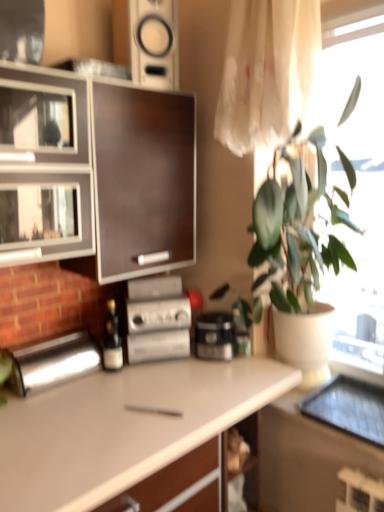
Find the location of `white glossy speaker at upper center`. white glossy speaker at upper center is located at coordinates (154, 42).

What do you see at coordinates (295, 232) in the screenshot?
I see `green matte plant at upper right` at bounding box center [295, 232].

The height and width of the screenshot is (512, 384). What do you see at coordinates (243, 463) in the screenshot?
I see `wooden shelf at lower center` at bounding box center [243, 463].

What do you see at coordinates (130, 168) in the screenshot? I see `dark wood cabinet at left` at bounding box center [130, 168].

This screenshot has height=512, width=384. What do you see at coordinates (267, 72) in the screenshot? I see `translucent white curtain at upper right` at bounding box center [267, 72].

Locate an element on the screen. The image size is (384, 512). silver metallic stereo at center, acting as the 2th appliance starting from the left is located at coordinates (157, 319).

Is green matte plant at upper right not within dark wood cabinet at left?

Indeed, green matte plant at upper right is completely outside dark wood cabinet at left.

Which is farther from the camera, (318,283) or (80,213)?

Positioned behind is point (318,283).

What's the angular difference between green matte plant at upper right and dark wood cabinet at left's facing directions?

green matte plant at upper right and dark wood cabinet at left are facing 90.1 degrees away from each other.

From a real-world perspective, is green matte plant at upper right physically below dark wood cabinet at left?

Yes, from a real-world perspective, green matte plant at upper right is under dark wood cabinet at left.

Can you confirm if polished stainless steel bread bin at left, the 2th appliance positioned from the right, is taller than silver metallic stereo at center, acting as the 2th appliance starting from the left?

Incorrect, the height of polished stainless steel bread bin at left, the 2th appliance positioned from the right, is not larger of that of silver metallic stereo at center, acting as the 2th appliance starting from the left.

You are a GUI agent. You are given a task and a screenshot of the screen. Output one action in this format:
    pyautogui.click(x=<x>, y=<y>)
    Task: Click on the appliance above the polished stainless steel bread bin at left, acting as the first appliance starting from the left (from a real-world perspective)
    The image size is (384, 512).
    Given the screenshot: What is the action you would take?
    pyautogui.click(x=157, y=319)

Is polished stainless steel bread bin at left, acting as the first appliance starting from the left, beside silver metallic stereo at center, acting as the 2th appliance starting from the left?

No, polished stainless steel bread bin at left, acting as the first appliance starting from the left, is not beside silver metallic stereo at center, acting as the 2th appliance starting from the left.

How much distance is there between polished stainless steel bread bin at left, acting as the first appliance starting from the left, and silver metallic stereo at center, acting as the 2th appliance starting from the left?

11.27 inches.

From a real-world perspective, which is physically above, green matte plant at upper right or translucent white curtain at upper right?

translucent white curtain at upper right, from a real-world perspective.

Which is correct: green matte plant at upper right is inside translucent white curtain at upper right, or outside of it?

green matte plant at upper right cannot be found inside translucent white curtain at upper right.

From the image's perspective, which is above, green matte plant at upper right or translucent white curtain at upper right?

translucent white curtain at upper right, from the image's perspective.

Are translucent white curtain at upper right and white glossy speaker at upper center far apart?

No.

What's the angular difference between translucent white curtain at upper right and white glossy speaker at upper center's facing directions?

75.2 degrees.

Is translucent white curtain at upper right bigger than white glossy speaker at upper center?

Indeed, translucent white curtain at upper right has a larger size compared to white glossy speaker at upper center.

Is translucent white curtain at upper right to the left of white glossy speaker at upper center from the viewer's perspective?

Incorrect, translucent white curtain at upper right is not on the left side of white glossy speaker at upper center.

Is dark wood cabinet at left positioned before black plastic coffee maker at center?

Yes, it is in front of black plastic coffee maker at center.

Does dark wood cabinet at left contain black plastic coffee maker at center?

No, dark wood cabinet at left does not contain black plastic coffee maker at center.

Is dark wood cabinet at left directly adjacent to black plastic coffee maker at center?

No, dark wood cabinet at left is not touching black plastic coffee maker at center.

This screenshot has height=512, width=384. Find the location of `cabinetry above the black plastic coffee maker at center (from a real-world perspective)`. cabinetry above the black plastic coffee maker at center (from a real-world perspective) is located at coordinates (130, 168).

Can we say dark wood cabinet at left lies outside wooden shelf at lower center?

Answer: Yes, dark wood cabinet at left is outside of wooden shelf at lower center.

You are a GUI agent. You are given a task and a screenshot of the screen. Output one action in this format:
    pyautogui.click(x=<x>, y=<y>)
    Task: Click on the cabinetry in front of the wooden shelf at lower center
    
    Given the screenshot: What is the action you would take?
    pyautogui.click(x=130, y=168)

From a real-world perspective, does dark wood cabinet at left sit lower than wooden shelf at lower center?

No.

Is polished stainless steel bread bin at left, the 2th appliance positioned from the right, at the back of silver metallic stereo at center, acting as the 2th appliance starting from the left?

Result: That's not correct — silver metallic stereo at center, acting as the 2th appliance starting from the left, is not looking away from polished stainless steel bread bin at left, the 2th appliance positioned from the right.

Could you measure the distance between silver metallic stereo at center, acting as the 2th appliance starting from the left, and polished stainless steel bread bin at left, acting as the first appliance starting from the left?

silver metallic stereo at center, acting as the 2th appliance starting from the left, and polished stainless steel bread bin at left, acting as the first appliance starting from the left, are 11.27 inches apart from each other.

Based on the photo, is silver metallic stereo at center, acting as the 2th appliance starting from the left, in front of or behind polished stainless steel bread bin at left, the 2th appliance positioned from the right, in the image?

Clearly, silver metallic stereo at center, acting as the 2th appliance starting from the left, is behind polished stainless steel bread bin at left, the 2th appliance positioned from the right.

Looking at their sizes, would you say silver metallic stereo at center, which ranks as the 1th appliance in right-to-left order, is wider or thinner than polished stainless steel bread bin at left, acting as the first appliance starting from the left?

In the image, silver metallic stereo at center, which ranks as the 1th appliance in right-to-left order, appears to be wider than polished stainless steel bread bin at left, acting as the first appliance starting from the left.

Locate an element on the screen. This screenshot has width=384, height=512. houseplant that is in front of the dark wood cabinet at left is located at coordinates (295, 232).

The height and width of the screenshot is (512, 384). I want to click on appliance that appears above the polished stainless steel bread bin at left, the 2th appliance positioned from the right (from a real-world perspective), so click(x=157, y=319).

Estimate the real-world distances between objects in this image. Which object is closer to polished stainless steel bread bin at left, the 2th appliance positioned from the right, white matte countertop at center or green matte plant at upper right?

white matte countertop at center.

Which object lies further to the anchor point white matte countertop at center, green matte plant at upper right or dark wood cabinet at left?

dark wood cabinet at left is positioned further to the anchor white matte countertop at center.

Looking at the image, which one is located closer to black plastic coffee maker at center, translucent white curtain at upper right or polished stainless steel bread bin at left, the 2th appliance positioned from the right?

The object closer to black plastic coffee maker at center is polished stainless steel bread bin at left, the 2th appliance positioned from the right.

Based on the photo, when comparing their distances from wooden shelf at lower center, does silver metallic stereo at center, acting as the 2th appliance starting from the left, or white glossy speaker at upper center seem closer?

silver metallic stereo at center, acting as the 2th appliance starting from the left, lies closer to wooden shelf at lower center than the other object.

Based on their spatial positions, is polished stainless steel bread bin at left, acting as the first appliance starting from the left, or translucent white curtain at upper right closer to wooden shelf at lower center?

polished stainless steel bread bin at left, acting as the first appliance starting from the left, is closer to wooden shelf at lower center.

Estimate the real-world distances between objects in this image. Which object is closer to white matte countertop at center, dark wood cabinet at left or black plastic coffee maker at center?

black plastic coffee maker at center is closer to white matte countertop at center.

Based on the photo, considering their positions, is white glossy speaker at upper center positioned further to wooden shelf at lower center than silver metallic stereo at center, which ranks as the 1th appliance in right-to-left order?

Based on the image, white glossy speaker at upper center appears to be further to wooden shelf at lower center.

When comparing their distances from translucent white curtain at upper right, does silver metallic stereo at center, which ranks as the 1th appliance in right-to-left order, or black plastic coffee maker at center seem further?

black plastic coffee maker at center is further to translucent white curtain at upper right.

Identify the location of appliance between polished stainless steel bread bin at left, the 2th appliance positioned from the right, and black plastic coffee maker at center. The width and height of the screenshot is (384, 512). (157, 319).

Find the location of a particular element. This screenshot has width=384, height=512. kitchen appliance between silver metallic stereo at center, acting as the 2th appliance starting from the left, and wooden shelf at lower center in the up-down direction is located at coordinates (214, 336).

The width and height of the screenshot is (384, 512). Find the location of `houseplant between dark wood cabinet at left and wooden shelf at lower center in the vertical direction`. houseplant between dark wood cabinet at left and wooden shelf at lower center in the vertical direction is located at coordinates (295, 232).

Find the location of a particular element. The image size is (384, 512). cabinetry between white glossy speaker at upper center and polished stainless steel bread bin at left, the 2th appliance positioned from the right, in the vertical direction is located at coordinates (130, 168).